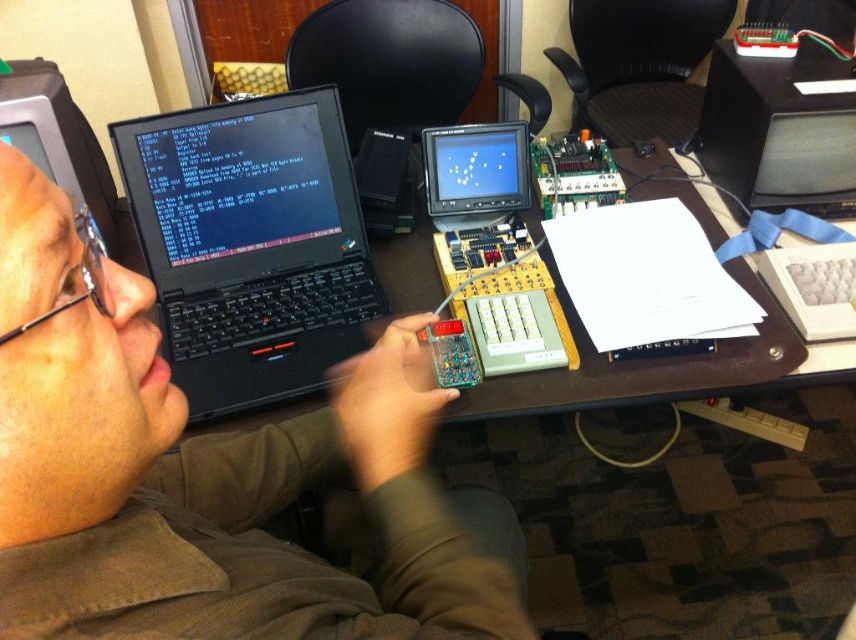
You are organizing a workspace and need to place a new tool on the largest surface available. Which object should you choose between the matte black laptop at upper left and the brown wooden table at center?

The brown wooden table at center is larger than the matte black laptop at upper left, so you should place the new tool on the brown wooden table at center.

You are a technician trying to adjust the lighting in the workspace. You need to place a lamp so that it illuminates both the matte black laptop at upper left and the matte plastic monitor at center without causing glare. Based on their positions, which object should the lamp be placed closer to?

The matte black laptop at upper left is positioned under the matte plastic monitor at center. To avoid glare on both screens, the lamp should be placed closer to the matte black laptop at upper left so that the light can reach both without reflecting off the monitor above it.

You are organizing a workshop and need to place a new tool on the desk. The tool requires a surface area larger than the black matte laptop at center. Can the brown wooden table at center accommodate it?

The black matte laptop at center is smaller than the brown wooden table at center, so yes, the brown wooden table at center can accommodate the tool requiring a larger surface area.